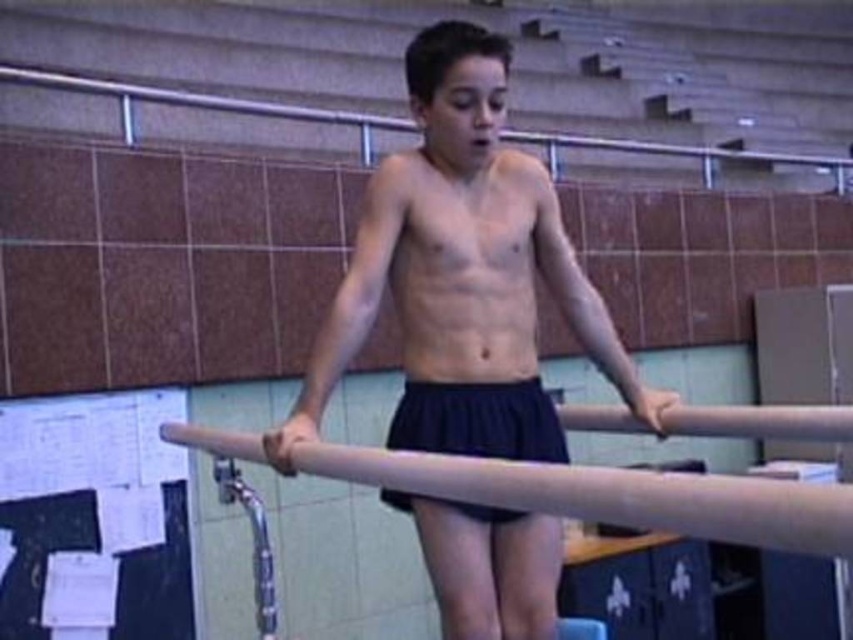
Question: Estimate the real-world distances between objects in this image. Which object is closer to the smooth wood beam at center?

Choices:
 (A) white paper at left
 (B) black fabric shorts at center
 (C) smooth skin man at center
 (D) metallic rail at upper center

Answer: (B)

Question: Which point is closer to the camera?

Choices:
 (A) metallic rail at upper center
 (B) black fabric shorts at center
 (C) smooth skin man at center

Answer: (C)

Question: Among these objects, which one is nearest to the camera?

Choices:
 (A) black fabric shorts at center
 (B) smooth skin man at center
 (C) metallic rail at upper center
 (D) smooth wood beam at center

Answer: (D)

Question: Is white paper at left below metallic rail at upper center?

Choices:
 (A) no
 (B) yes

Answer: (B)

Question: Is smooth skin man at center to the right of black fabric shorts at center from the viewer's perspective?

Choices:
 (A) yes
 (B) no

Answer: (B)

Question: Observing the image, what is the correct spatial positioning of white paper at left in reference to metallic rail at upper center?

Choices:
 (A) left
 (B) right

Answer: (A)